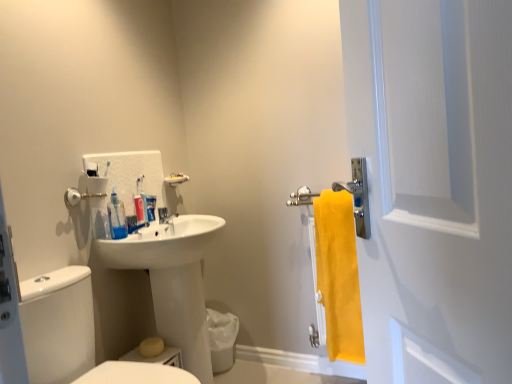
What do you see at coordinates (150, 207) in the screenshot? I see `white matte toothpaste at center` at bounding box center [150, 207].

The width and height of the screenshot is (512, 384). What do you see at coordinates (165, 215) in the screenshot?
I see `satin nickel faucet at sink left` at bounding box center [165, 215].

Locate an element on the screen. Image resolution: width=512 pixels, height=384 pixels. translucent plastic toothpaste tube at upper center is located at coordinates (141, 203).

What do you see at coordinates (117, 217) in the screenshot?
I see `transparent plastic mouthwash at center` at bounding box center [117, 217].

Locate an element on the screen. The image size is (512, 384). transparent plastic mouthwash at center is located at coordinates (x=117, y=217).

Locate an element on the screen. This screenshot has height=384, width=512. yellow fabric towel at right is located at coordinates (339, 275).

Considering the positions of objects white matte toothpaste at center and satin nickel faucet at sink left in the image provided, who is behind, white matte toothpaste at center or satin nickel faucet at sink left?

satin nickel faucet at sink left.

Between point (156, 197) and point (162, 217), which one is positioned in front?

Positioned in front is point (162, 217).

Does white matte toothpaste at center have a greater width compared to satin nickel faucet at sink left?

No, white matte toothpaste at center is not wider than satin nickel faucet at sink left.

Is yellow fabric towel at right further to the viewer compared to transparent plastic mouthwash at center?

Yes, the depth of yellow fabric towel at right is greater than that of transparent plastic mouthwash at center.

Which is closer, (346,352) or (125,218)?

Positioned in front is point (125,218).

Considering the relative sizes of yellow fabric towel at right and transparent plastic mouthwash at center in the image provided, is yellow fabric towel at right smaller than transparent plastic mouthwash at center?

Actually, yellow fabric towel at right might be larger than transparent plastic mouthwash at center.

Is white glossy sink at center next to white glossy toilet at lower left?

They are not placed beside each other.

At what (x,y) coordinates should I click in order to perform the action: click on toilet above the white glossy sink at center (from the image's perspective). Please return your answer as a coordinate pair (x, y). The height and width of the screenshot is (384, 512). Looking at the image, I should click on (58, 334).

Which object is positioned more to the right, white glossy sink at center or white glossy toilet at lower left?

From the viewer's perspective, white glossy sink at center appears more on the right side.

Is translucent plastic toothpaste tube at upper center not within white matte screen door at right?

Yes, translucent plastic toothpaste tube at upper center is outside of white matte screen door at right.

From the image's perspective, is translucent plastic toothpaste tube at upper center below white matte screen door at right?

Yes, from the image's perspective, translucent plastic toothpaste tube at upper center is beneath white matte screen door at right.

Considering the relative positions of translucent plastic toothpaste tube at upper center and white matte screen door at right in the image provided, is translucent plastic toothpaste tube at upper center to the left of white matte screen door at right from the viewer's perspective?

Yes, translucent plastic toothpaste tube at upper center is to the left of white matte screen door at right.

How different are the orientations of translucent plastic toothpaste tube at upper center and white matte screen door at right in degrees?

There is a 31.6-degree angle between the facing directions of translucent plastic toothpaste tube at upper center and white matte screen door at right.

Looking at the image, does translucent plastic toothpaste tube at upper center seem bigger or smaller compared to satin nickel faucet at sink left?

Considering their sizes, translucent plastic toothpaste tube at upper center takes up less space than satin nickel faucet at sink left.

Is satin nickel faucet at sink left surrounded by translucent plastic toothpaste tube at upper center?

Definitely not — satin nickel faucet at sink left is not inside translucent plastic toothpaste tube at upper center.

Which object is more forward, translucent plastic toothpaste tube at upper center or satin nickel faucet at sink left?

translucent plastic toothpaste tube at upper center is in front.

Consider the image. Which of these two, translucent plastic toothpaste tube at upper center or satin nickel faucet at sink left, stands taller?

Standing taller between the two is translucent plastic toothpaste tube at upper center.

From a real-world perspective, which is physically below, transparent plastic mouthwash at center or white matte screen door at right?

transparent plastic mouthwash at center.

Is transparent plastic mouthwash at center at the right side of white matte screen door at right?

No, transparent plastic mouthwash at center is not to the right of white matte screen door at right.

Do you think transparent plastic mouthwash at center is within white matte screen door at right, or outside of it?

transparent plastic mouthwash at center is spatially situated outside white matte screen door at right.

Does transparent plastic mouthwash at center have a smaller size compared to white matte screen door at right?

Indeed, transparent plastic mouthwash at center has a smaller size compared to white matte screen door at right.

From a real-world perspective, is white matte toothpaste at center physically located above or below white glossy toilet at lower left?

In terms of real-world spatial position, white matte toothpaste at center is above white glossy toilet at lower left.

Is white matte toothpaste at center inside the boundaries of white glossy toilet at lower left, or outside?

white matte toothpaste at center is located beyond the bounds of white glossy toilet at lower left.

Is white matte toothpaste at center looking in the opposite direction of white glossy toilet at lower left?

white matte toothpaste at center is not turned away from white glossy toilet at lower left.

There is a satin nickel faucet at sink left. At what (x,y) coordinates should I click in order to perform the action: click on toothpaste above it (from a real-world perspective). Please return your answer as a coordinate pair (x, y). Image resolution: width=512 pixels, height=384 pixels. Looking at the image, I should click on (x=150, y=207).

This screenshot has width=512, height=384. What are the coordinates of `bath towel on the right of transparent plastic mouthwash at center` in the screenshot? It's located at [339, 275].

Which object lies further to the anchor point yellow fabric towel at right, transparent plastic mouthwash at center or white matte screen door at right?

white matte screen door at right.

Looking at the image, which one is located closer to yellow fabric towel at right, white matte toothpaste at center or transparent plastic mouthwash at center?

The object closer to yellow fabric towel at right is white matte toothpaste at center.

Based on their spatial positions, is white matte toothpaste at center or white matte screen door at right further from satin nickel faucet at sink left?

Based on the image, white matte screen door at right appears to be further to satin nickel faucet at sink left.

Consider the image. From the image, which object appears to be farther from white glossy toilet at lower left, translucent plastic toothpaste tube at upper center or yellow fabric towel at right?

Based on the image, yellow fabric towel at right appears to be further to white glossy toilet at lower left.

Estimate the real-world distances between objects in this image. Which object is further from white matte toothpaste at center, satin nickel faucet at sink left or transparent plastic mouthwash at center?

transparent plastic mouthwash at center.

When comparing their distances from white glossy sink at center, does translucent plastic toothpaste tube at upper center or transparent plastic mouthwash at center seem further?

translucent plastic toothpaste tube at upper center.

Estimate the real-world distances between objects in this image. Which object is closer to white glossy toilet at lower left, white matte screen door at right or white glossy sink at center?

Among the two, white glossy sink at center is located nearer to white glossy toilet at lower left.

Based on their spatial positions, is white matte toothpaste at center or satin nickel faucet at sink left closer to white glossy sink at center?

Based on the image, satin nickel faucet at sink left appears to be nearer to white glossy sink at center.

Locate an element on the screen. The width and height of the screenshot is (512, 384). mouthwash between white glossy toilet at lower left and translucent plastic toothpaste tube at upper center along the z-axis is located at coordinates (117, 217).

This screenshot has width=512, height=384. Find the location of `toothpaste between white glossy toilet at lower left and satin nickel faucet at sink left from front to back`. toothpaste between white glossy toilet at lower left and satin nickel faucet at sink left from front to back is located at coordinates (150, 207).

Locate an element on the screen. toothpaste between translucent plastic toothpaste tube at upper center and satin nickel faucet at sink left from front to back is located at coordinates (150, 207).

The image size is (512, 384). I want to click on sink between white glossy toilet at lower left and translucent plastic toothpaste tube at upper center in the front-back direction, so click(x=173, y=281).